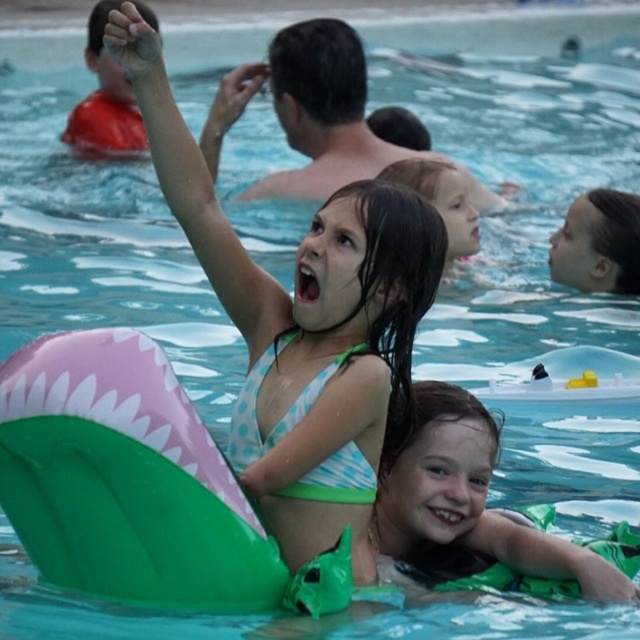
Question: Does polka dot bikini at center have a smaller size compared to light brown hair at upper center?

Choices:
 (A) no
 (B) yes

Answer: (A)

Question: Estimate the real-world distances between objects in this image. Which object is farther from the polka dot bikini at center?

Choices:
 (A) green rubber ring at lower right
 (B) light brown hair at upper center

Answer: (B)

Question: Which object appears closest to the camera in this image?

Choices:
 (A) polka dot bikini at center
 (B) green rubber ring at lower right

Answer: (A)

Question: Does polka dot bikini at center appear on the left side of light brown hair at upper center?

Choices:
 (A) yes
 (B) no

Answer: (A)

Question: Is polka dot bikini at center to the right of light brown hair at upper center from the viewer's perspective?

Choices:
 (A) no
 (B) yes

Answer: (A)

Question: Which point is closer to the camera?

Choices:
 (A) green rubber ring at lower right
 (B) light brown hair at upper center

Answer: (A)